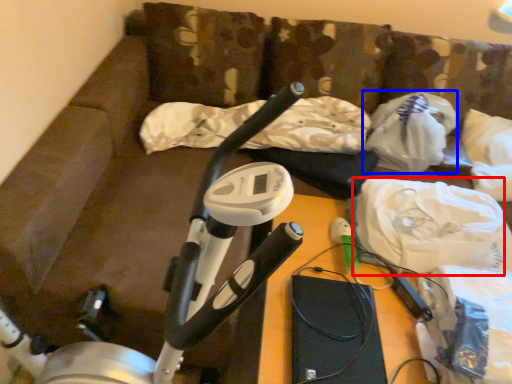
Question: Among these objects, which one is nearest to the camera, material (highlighted by a red box) or plastic bag (highlighted by a blue box)?

Choices:
 (A) material
 (B) plastic bag

Answer: (A)